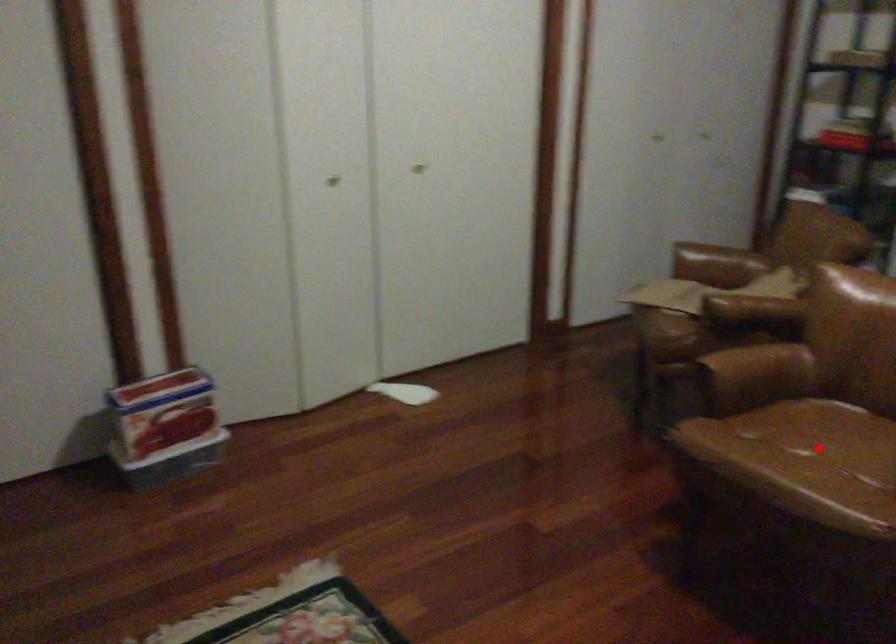
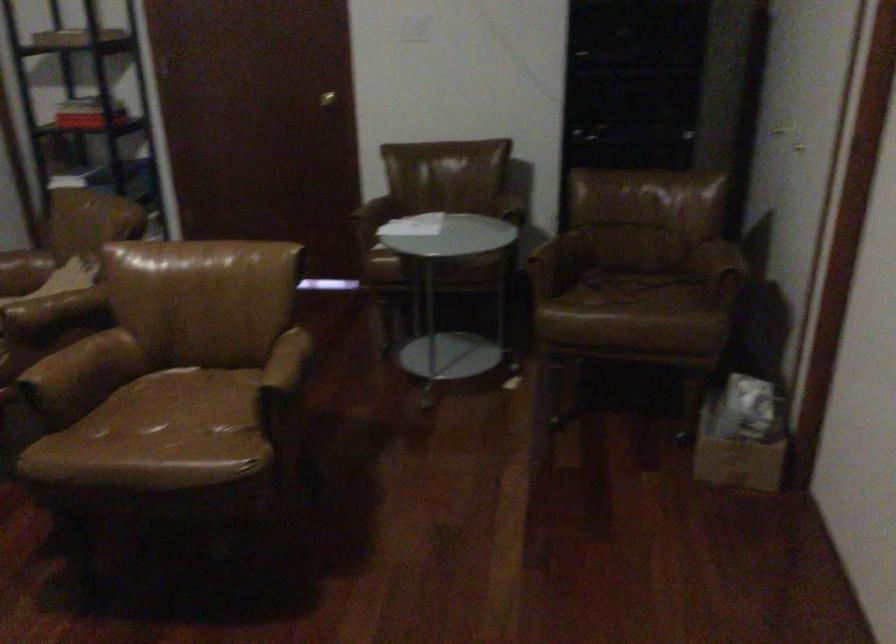
Locate, in the second image, the point that corresponds to the highlighted location in the first image.

(178, 413)